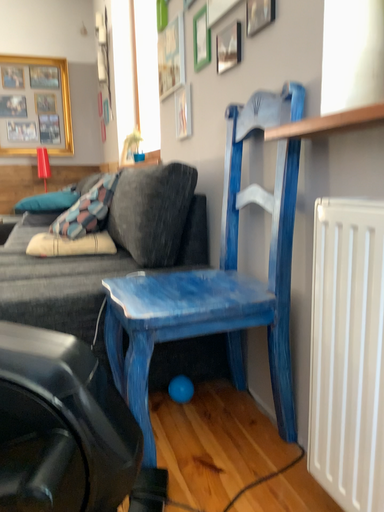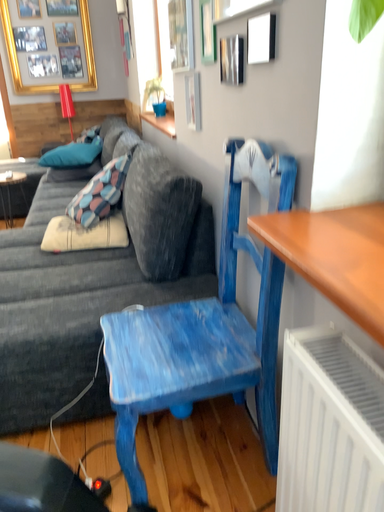
Question: Which way did the camera rotate in the video?

Choices:
 (A) rotated downward
 (B) rotated upward

Answer: (A)